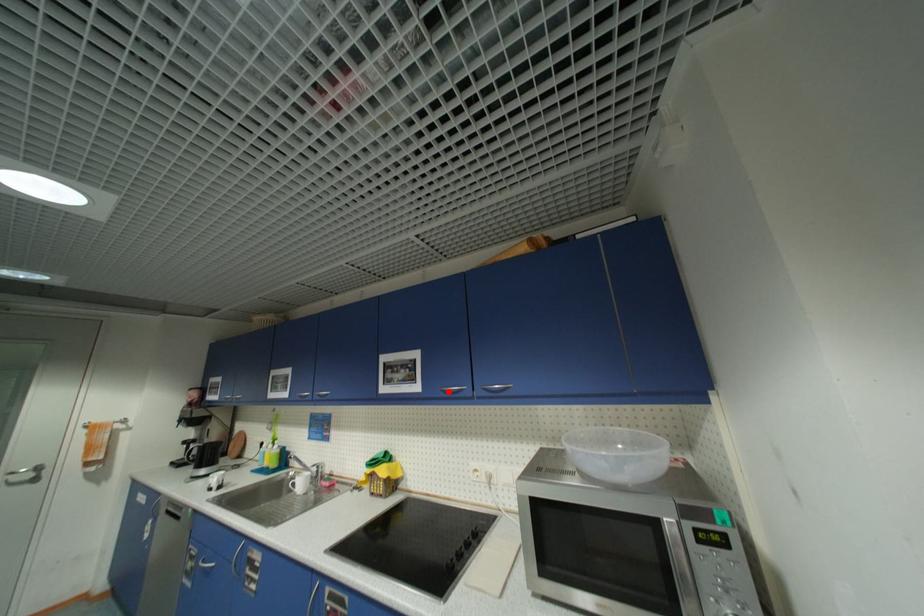
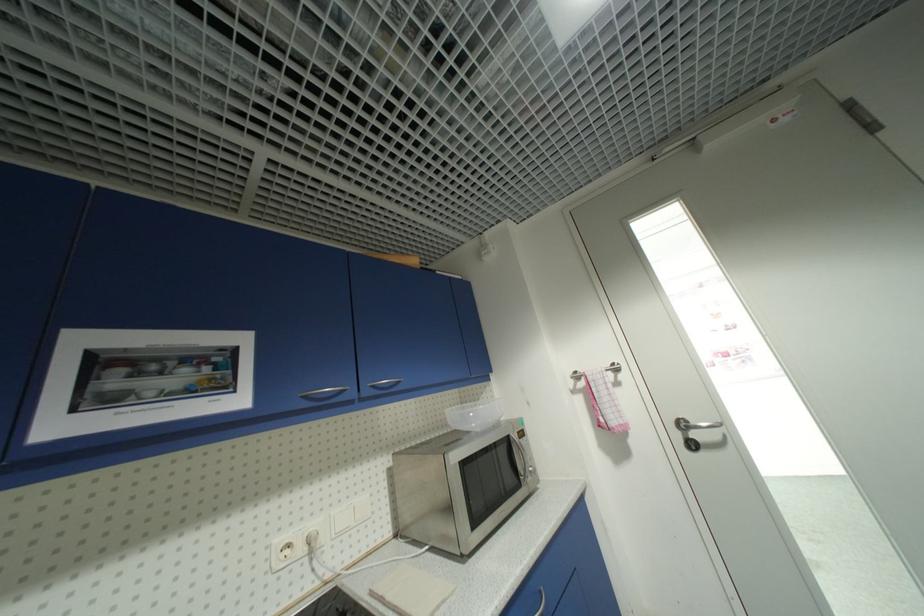
Where in the second image is the point corresponding to the highlighted location from the first image?

(311, 399)